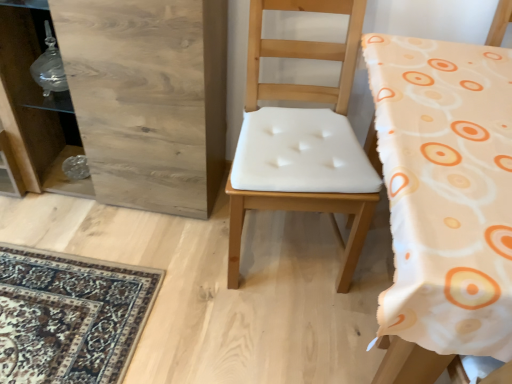
Question: Can you confirm if wooden dresser at left is bigger than white fabric chair at center, which ranks as the first chair in left-to-right order?

Choices:
 (A) yes
 (B) no

Answer: (A)

Question: Is wooden dresser at left in front of white fabric chair at center, which ranks as the first chair in left-to-right order?

Choices:
 (A) yes
 (B) no

Answer: (B)

Question: From the image's perspective, would you say wooden dresser at left is shown under white fabric chair at center, which ranks as the first chair in left-to-right order?

Choices:
 (A) no
 (B) yes

Answer: (A)

Question: Is wooden dresser at left at the right side of white fabric chair at center, which ranks as the first chair in left-to-right order?

Choices:
 (A) no
 (B) yes

Answer: (A)

Question: Is wooden dresser at left facing towards white fabric chair at center, arranged as the second chair when viewed from the right?

Choices:
 (A) yes
 (B) no

Answer: (B)

Question: Is wooden dresser at left smaller than white fabric chair at center, which ranks as the first chair in left-to-right order?

Choices:
 (A) yes
 (B) no

Answer: (B)

Question: Does white fabric chair at center, which is the 2th chair in left-to-right order, have a smaller size compared to wooden dresser at left?

Choices:
 (A) yes
 (B) no

Answer: (A)

Question: Can you confirm if white fabric chair at center, which is the 2th chair in left-to-right order, is shorter than wooden dresser at left?

Choices:
 (A) yes
 (B) no

Answer: (B)

Question: Is white fabric chair at center, which is the 2th chair in left-to-right order, wider than wooden dresser at left?

Choices:
 (A) yes
 (B) no

Answer: (A)

Question: Is white fabric chair at center, which is the 2th chair in left-to-right order, positioned beyond the bounds of wooden dresser at left?

Choices:
 (A) yes
 (B) no

Answer: (A)

Question: From the image's perspective, is white fabric chair at center, which is the 2th chair in left-to-right order, below wooden dresser at left?

Choices:
 (A) yes
 (B) no

Answer: (A)

Question: Is white fabric chair at center, which is the 2th chair in left-to-right order, thinner than wooden dresser at left?

Choices:
 (A) yes
 (B) no

Answer: (B)

Question: Considering the relative sizes of wooden dresser at left and white fabric chair at center, which is the 2th chair in left-to-right order, in the image provided, is wooden dresser at left wider than white fabric chair at center, which is the 2th chair in left-to-right order,?

Choices:
 (A) yes
 (B) no

Answer: (B)